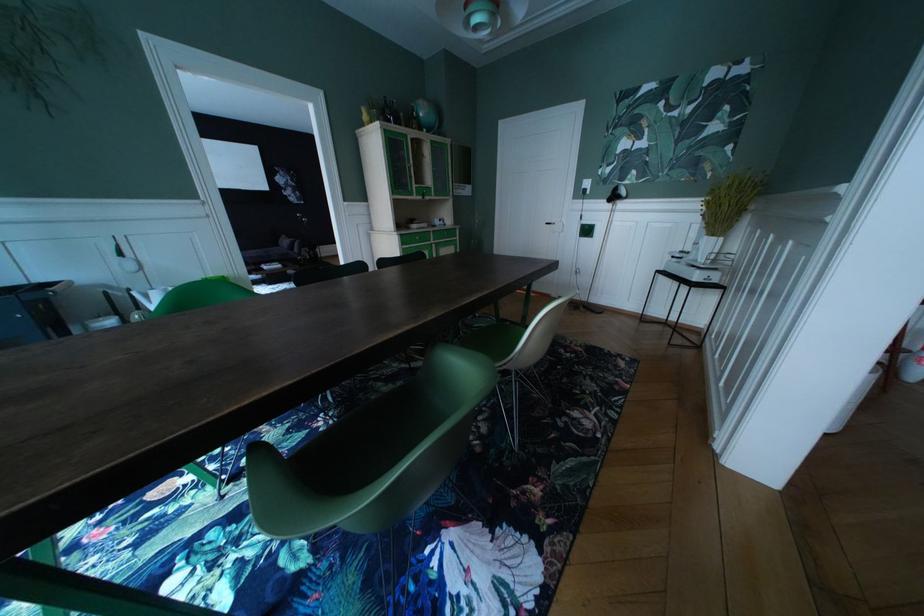
Find where to sit the white chair sitting surface. Please return your answer as a coordinate pair (x, y).

(372, 454)